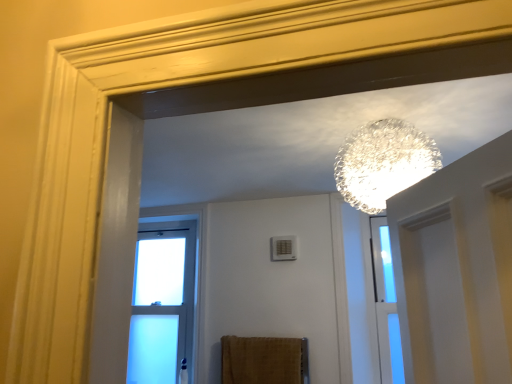
Question: From the image's perspective, is clear glass sphere at upper center located above or below clear glass window at center?

Choices:
 (A) above
 (B) below

Answer: (A)

Question: Is clear glass sphere at upper center inside or outside of clear glass window at center?

Choices:
 (A) inside
 (B) outside

Answer: (B)

Question: Estimate the real-world distances between objects in this image. Which object is farther from the clear glass sphere at upper center?

Choices:
 (A) clear glass window at center
 (B) brown textured towel at lower center

Answer: (A)

Question: Which object is the closest to the clear glass window at center?

Choices:
 (A) brown textured towel at lower center
 (B) clear glass sphere at upper center

Answer: (A)